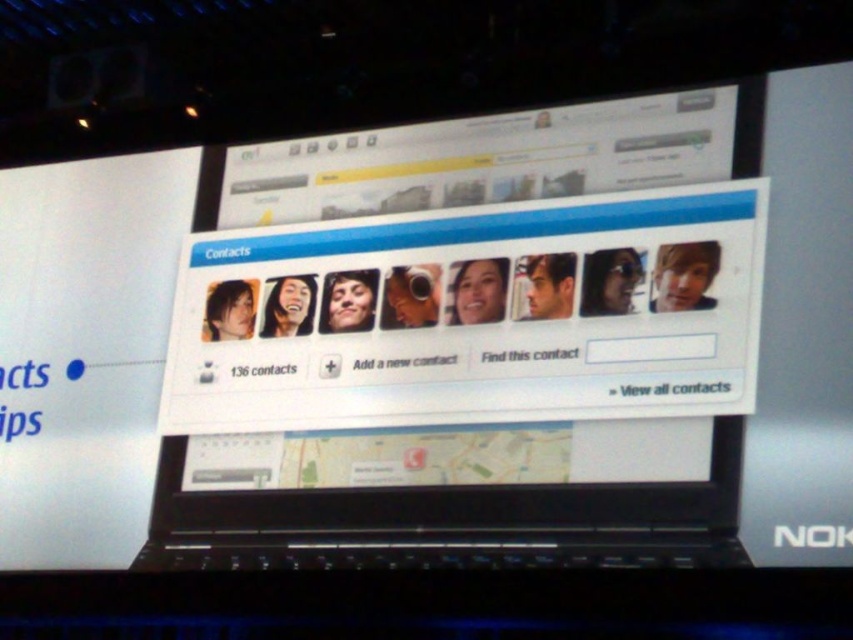
Can you confirm if black plastic laptop at center is smaller than black plastic nokia logo at center?

Yes, black plastic laptop at center is smaller than black plastic nokia logo at center.

Can you confirm if black plastic laptop at center is wider than black plastic nokia logo at center?

In fact, black plastic laptop at center might be narrower than black plastic nokia logo at center.

Find the location of a particular element. This screenshot has height=640, width=853. black plastic laptop at center is located at coordinates (469, 348).